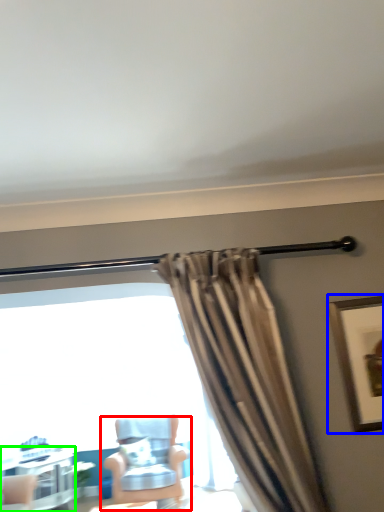
Question: Based on their relative distances, which object is farther from chair (highlighted by a red box)? Choose from picture frame (highlighted by a blue box) and table (highlighted by a green box).

Choices:
 (A) picture frame
 (B) table

Answer: (A)